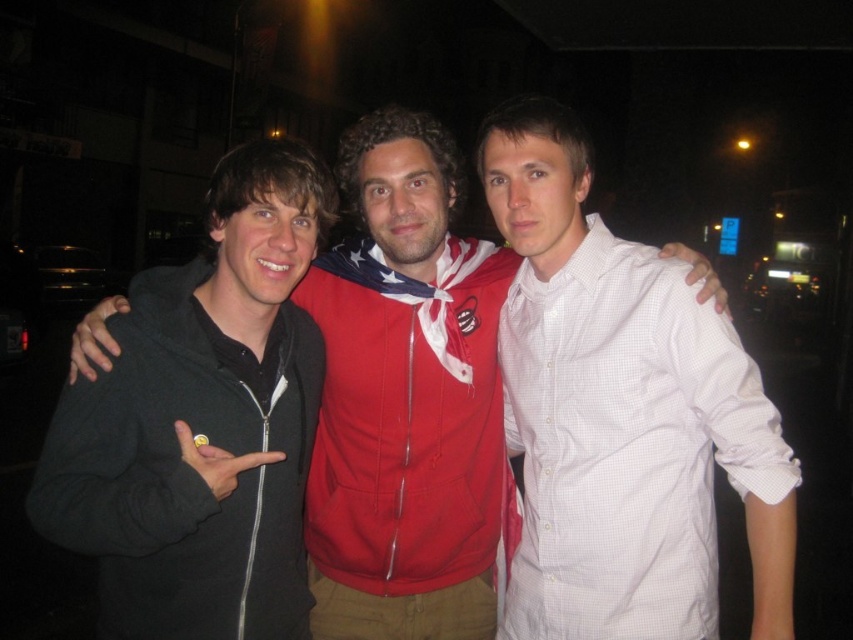
You are a photographer trying to capture a clear shot of the white checkered shirt at center. Based on the coordinates provided, where should you aim your camera to ensure the shirt is centered in the frame?

To center the white checkered shirt at center in the frame, aim your camera at the coordinates point (621, 413) provided in the description.